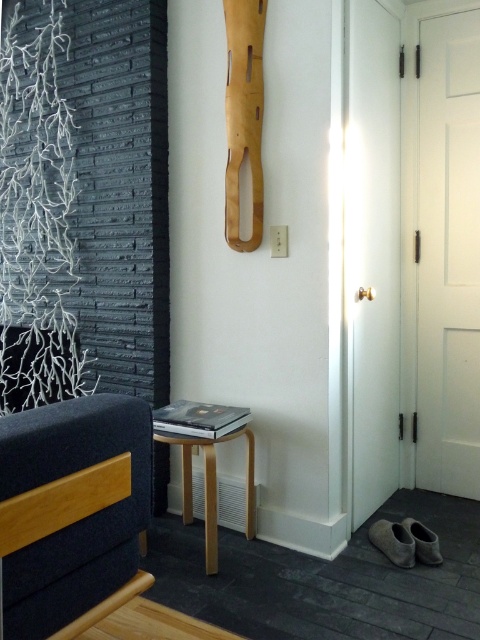
Who is positioned more to the right, dark blue fabric couch at lower left or light wood/veneer side table at lower center?

light wood/veneer side table at lower center

Is dark blue fabric couch at lower left closer to the viewer compared to light wood/veneer side table at lower center?

That is True.

Is point (70, 596) positioned after point (250, 444)?

No, (70, 596) is closer to viewer.

Locate an element on the screen. The image size is (480, 640). dark blue fabric couch at lower left is located at coordinates (72, 513).